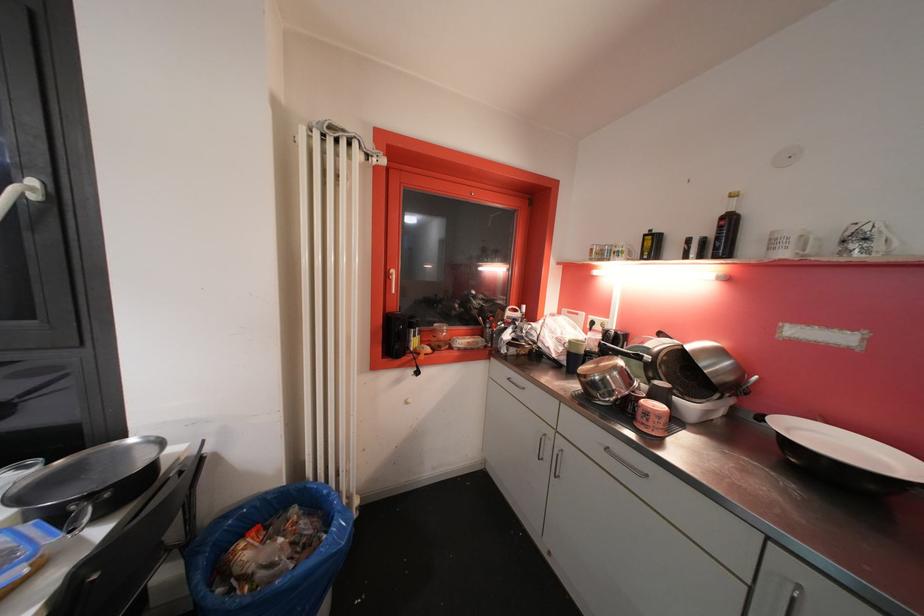
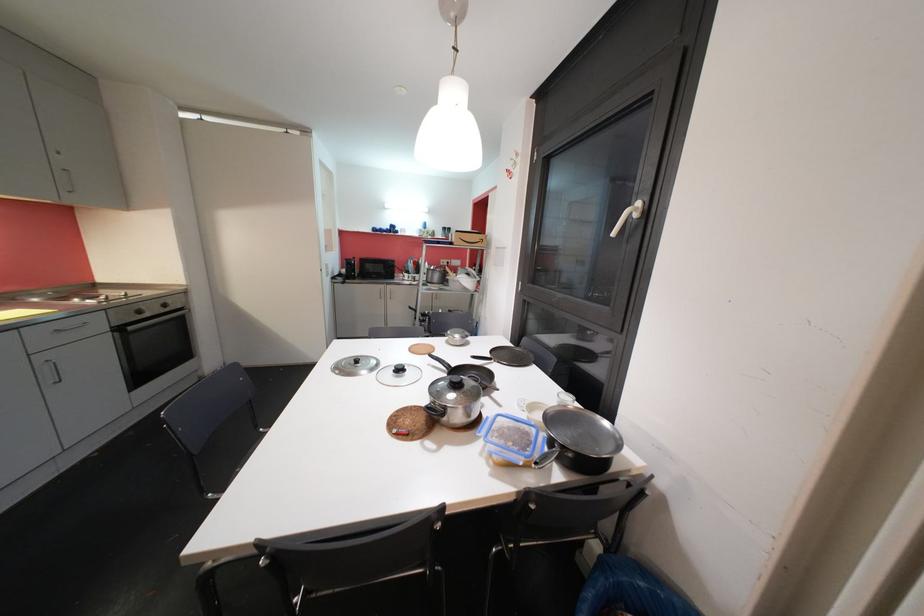
Question: The camera is either moving clockwise (left) or counter-clockwise (right) around the object. The first image is from the beginning of the video and the second image is from the end. Is the camera moving left or right when shooting the video?

Choices:
 (A) Left
 (B) Right

Answer: (B)